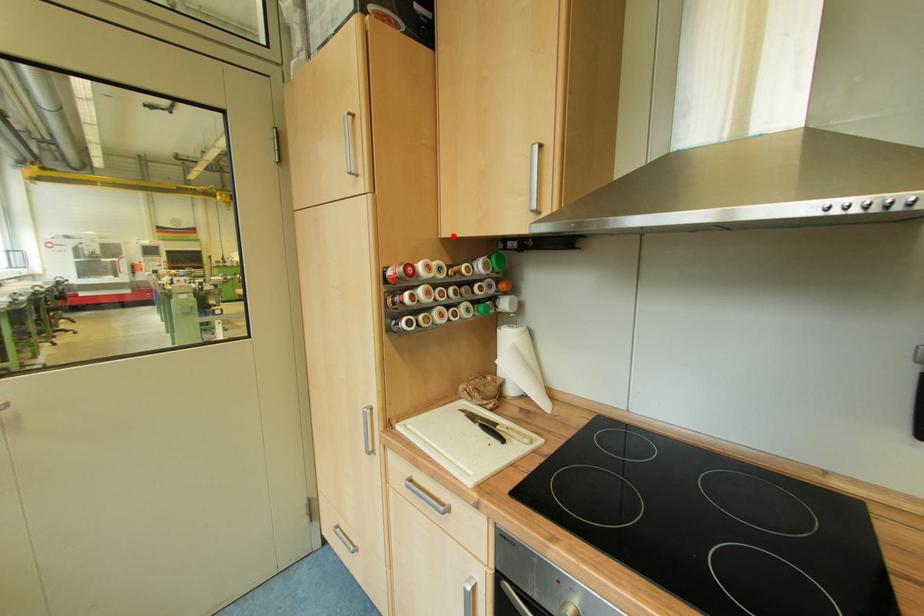
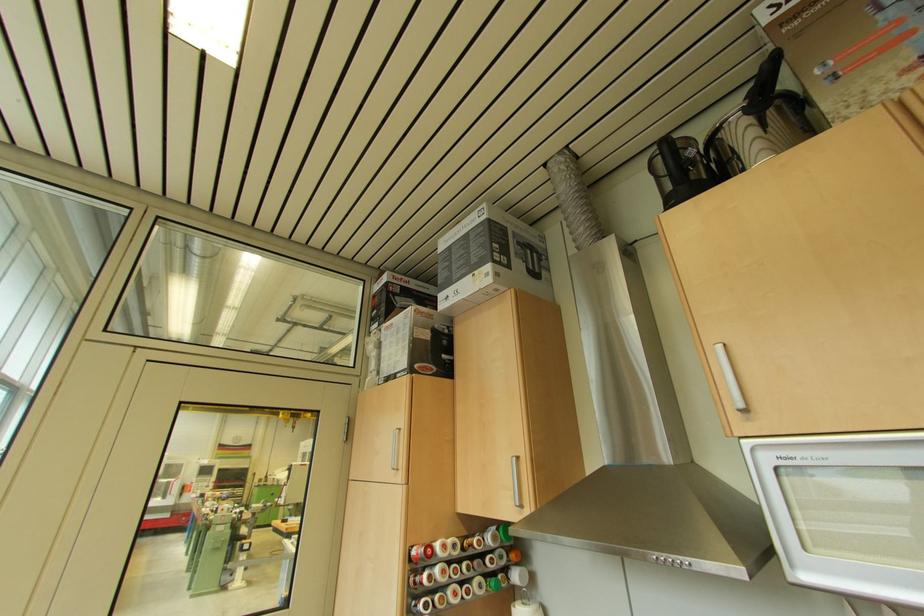
Find the pixel in the second image that matches the highlighted location in the first image.

(468, 513)